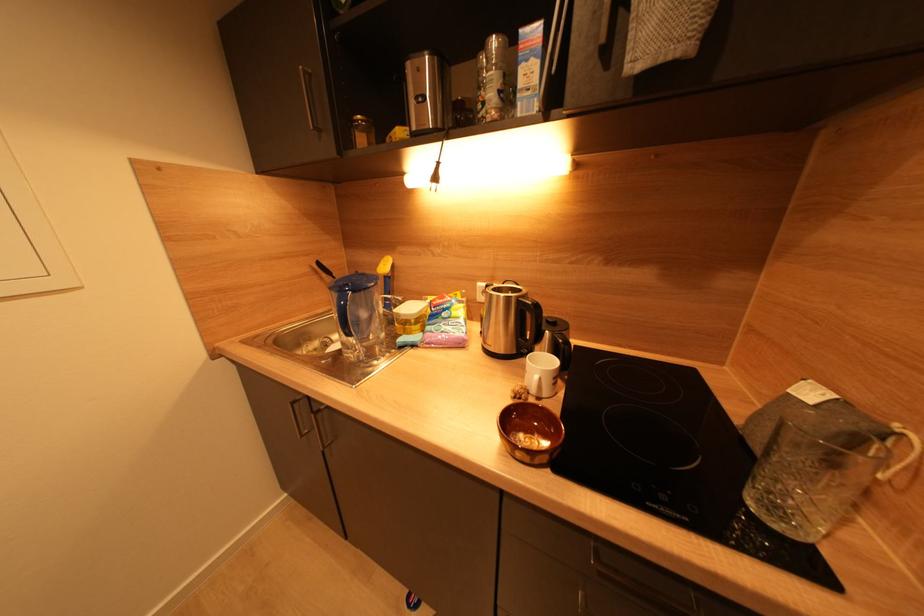
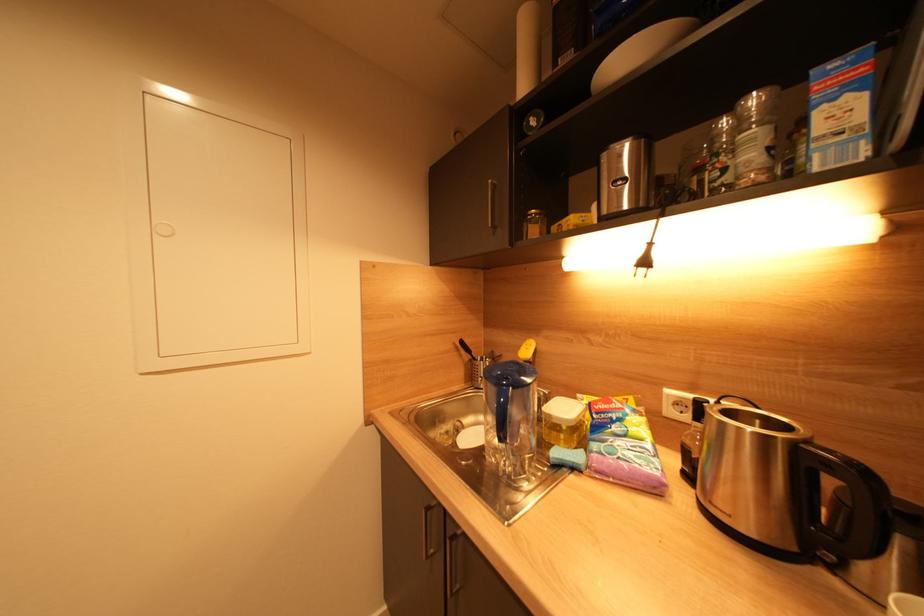
In a continuous first-person perspective shot, in which direction is the camera moving?

The cameraman moved toward left, forward.